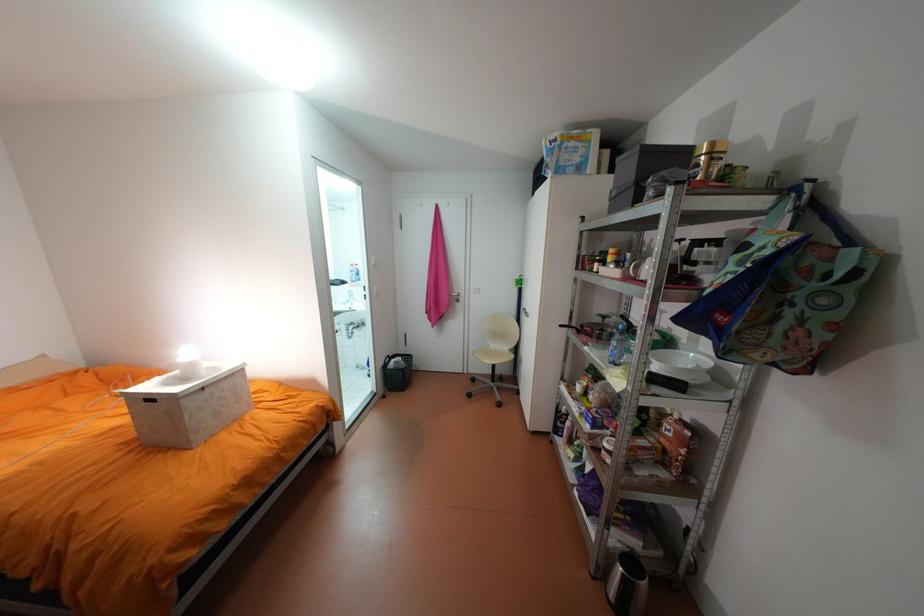
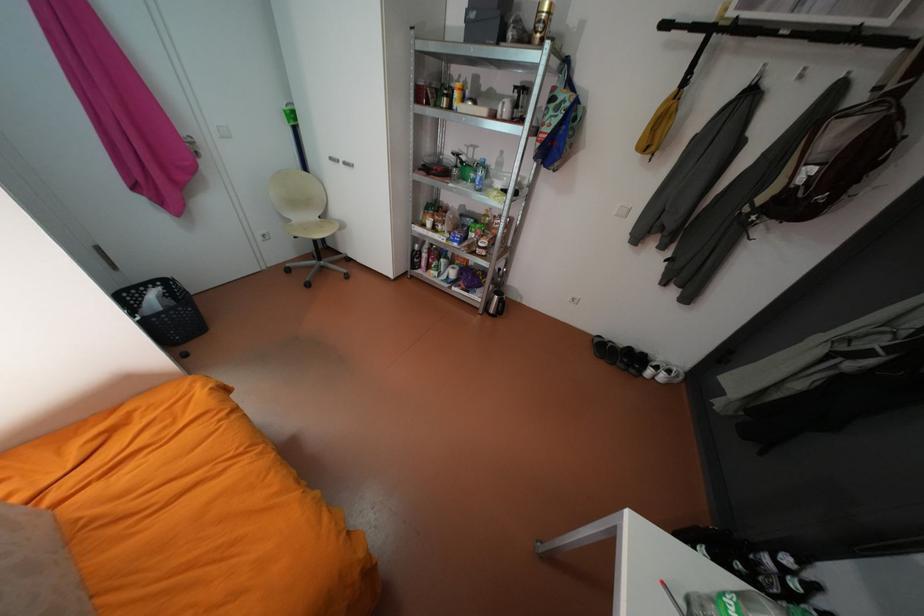
Find the pixel in the second image that matches point 565,429 in the first image.

(423, 265)